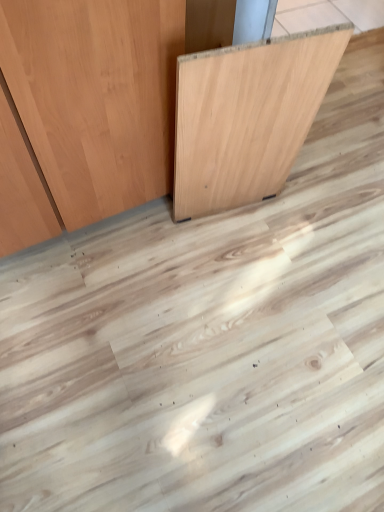
Find the location of `empty space that is to the right of natural wood board at center`. empty space that is to the right of natural wood board at center is located at coordinates (330, 182).